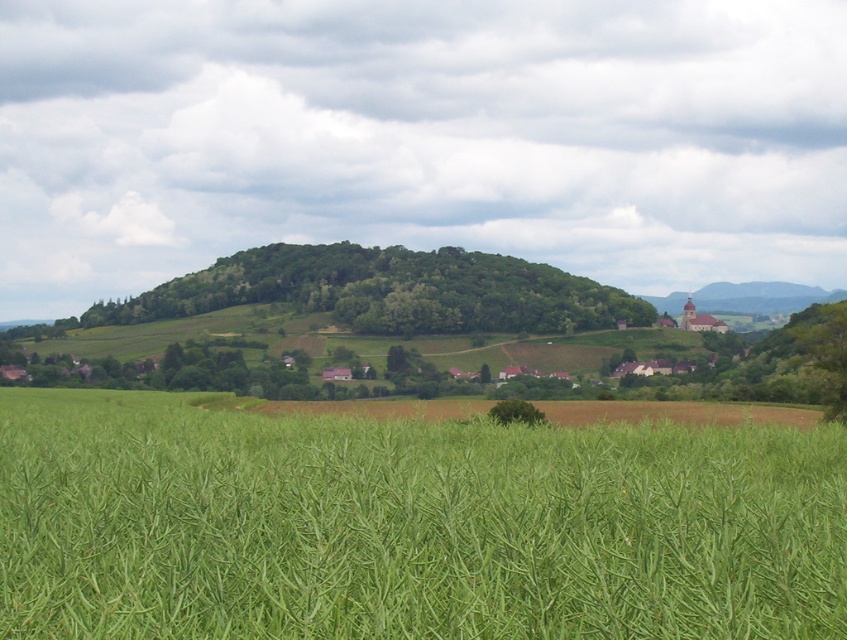
What are the coordinates of `green leafy hill at center` in the screenshot? It's located at (389, 291).

Which is behind, point (641, 308) or point (533, 417)?

The point (641, 308) is more distant.

Identify the location of green leafy hill at center. (389, 291).

Is green leafy hill at center to the left of matte brown church at right from the viewer's perspective?

Correct, you'll find green leafy hill at center to the left of matte brown church at right.

Does point (574, 314) come in front of point (834, 300)?

Yes, it is in front of point (834, 300).

Locate an element on the screen. The image size is (847, 640). green leafy hill at center is located at coordinates (389, 291).

Looking at this image, between green grassy field at lower center and green leafy tree at center, which one is positioned lower?

green leafy tree at center is below.

Between green grassy field at lower center and green leafy tree at center, which one has less height?

green grassy field at lower center is shorter.

Locate an element on the screen. This screenshot has height=640, width=847. green grassy field at lower center is located at coordinates (408, 525).